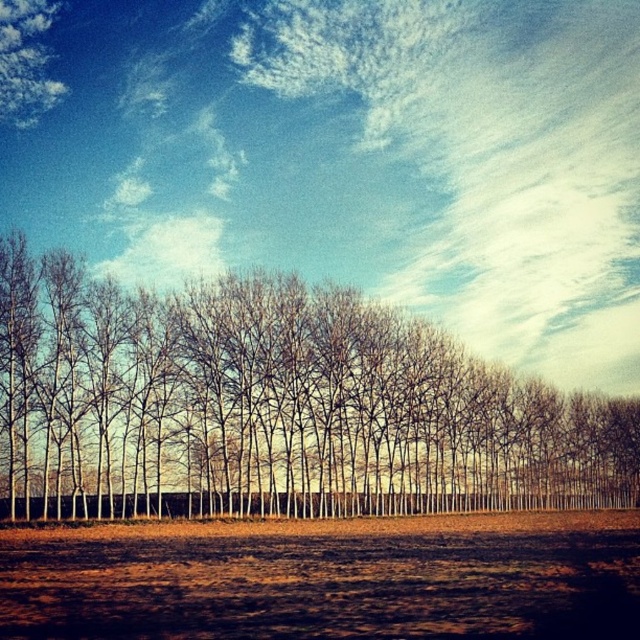
You are a gardener planning to plant a new tree sapling in the brown soil at lower center. Considering the height of the existing bare branches at center, will the sapling have enough vertical space to grow into a full tree without hitting the branches above?

The bare branches at center are taller than the brown soil at lower center, so there is sufficient vertical space for the sapling to grow into a full tree without obstruction from the branches above.

You are a gardener planning to plant a new tree in the brown soil at lower center. Considering the position of the bare branches at center, will the new tree receive enough sunlight once it grows taller?

The bare branches at center are located above the brown soil at lower center. Since the branches are bare and the trees are leafless, sunlight can pass through them, so the new tree planted in the brown soil at lower center will likely receive sufficient sunlight once it grows taller.